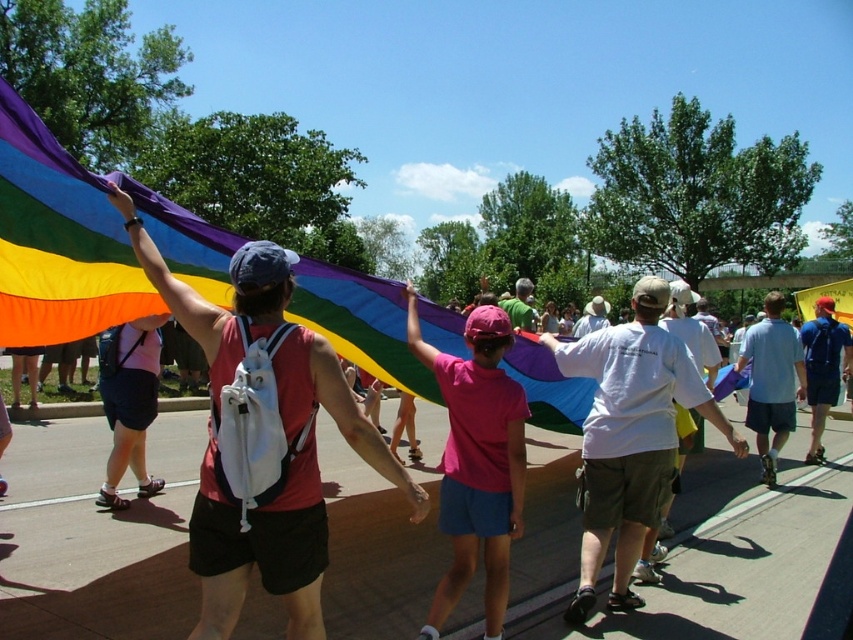
You are standing in the center of the scene and want to hand a leaflet to the person holding the rainbow fabric flag at upper left. In which direction should you move to approach them?

The rainbow fabric flag at upper left is located at point (x=84, y=241), so you should move towards the upper left direction to reach them.

You are a photographer trying to capture the rainbow fabric flag at upper left without any obstructions. Since you are standing at the center of the scene, will the blue backpack at center block your view of the flag?

The rainbow fabric flag at upper left is positioned over the blue backpack at center, so the blue backpack at center will block your view of the rainbow fabric flag at upper left.